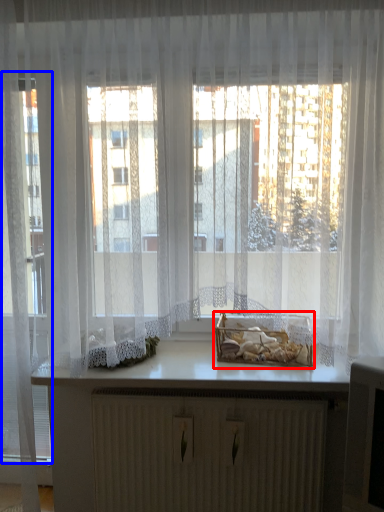
Question: Which of the following is the closest to the observer, window box (highlighted by a red box) or glass door (highlighted by a blue box)?

Choices:
 (A) window box
 (B) glass door

Answer: (B)